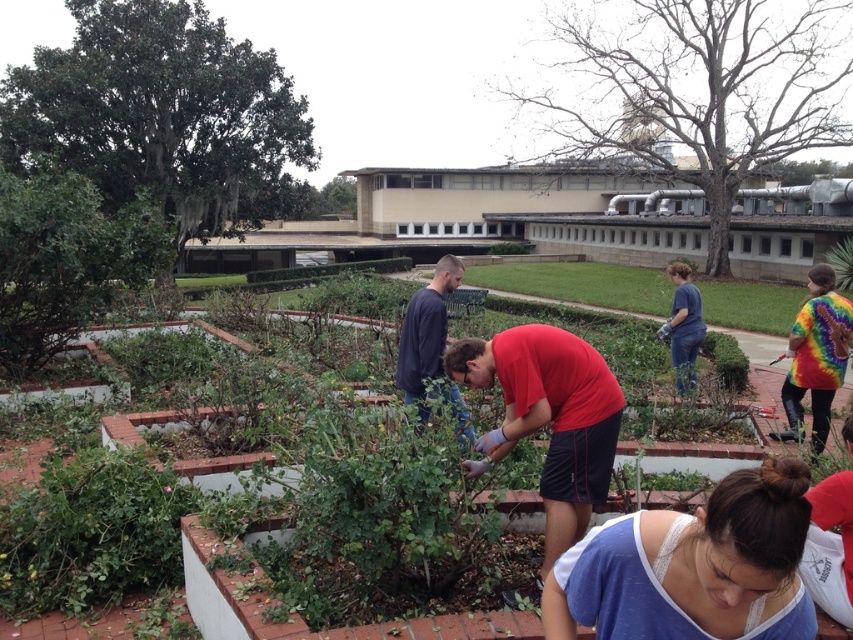
Question: Which object is farther from the camera taking this photo?

Choices:
 (A) blue lace tank top at lower center
 (B) green leafy plants at center
 (C) tie-dye fabric shirt at right

Answer: (C)

Question: In this image, where is tie-dye fabric shirt at right located relative to blue cotton shirt at center?

Choices:
 (A) right
 (B) left

Answer: (B)

Question: Which point is farther from the camera taking this photo?

Choices:
 (A) (646, 449)
 (B) (804, 518)
 (C) (537, 394)

Answer: (A)

Question: Can you confirm if blue lace tank top at lower center is thinner than red matte shirt at center?

Choices:
 (A) no
 (B) yes

Answer: (B)

Question: Is blue lace tank top at lower center to the left of blue cotton shirt at center from the viewer's perspective?

Choices:
 (A) no
 (B) yes

Answer: (B)

Question: Which is nearer to the blue lace tank top at lower center?

Choices:
 (A) green leafy plants at center
 (B) blue cotton shirt at center
 (C) red matte shirt at center
 (D) tie-dye fabric shirt at right

Answer: (A)